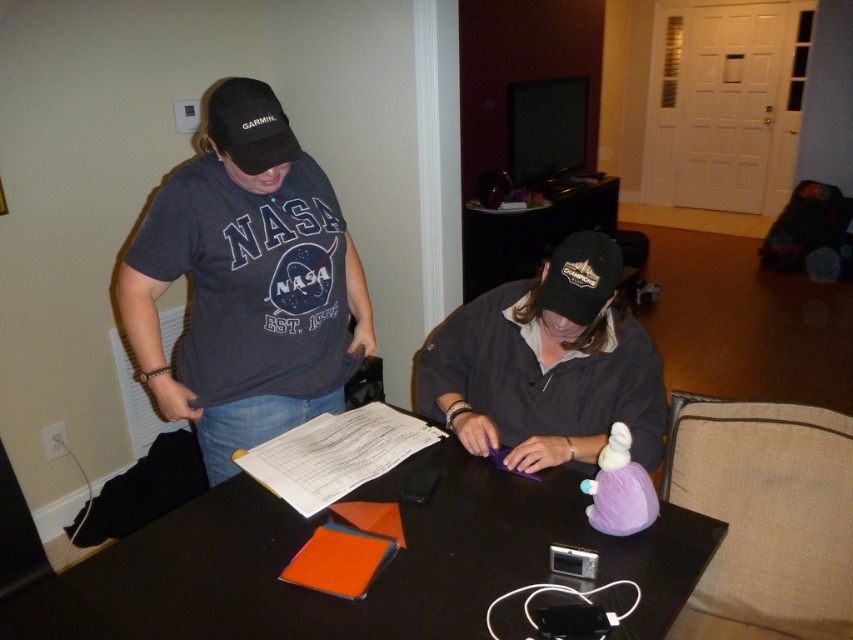
Question: Estimate the real-world distances between objects in this image. Which object is closer to the black fabric baseball cap at center?

Choices:
 (A) black matte cap at center
 (B) black glossy table at center
 (C) black fabric baseball cap at upper left
 (D) matte black t-shirt at left

Answer: (A)

Question: Is black glossy table at center wider than black fabric baseball cap at upper left?

Choices:
 (A) yes
 (B) no

Answer: (A)

Question: Which point is closer to the camera?

Choices:
 (A) (180, 176)
 (B) (590, 310)

Answer: (B)

Question: Is black glossy table at center above black fabric baseball cap at upper left?

Choices:
 (A) no
 (B) yes

Answer: (A)

Question: Is matte black t-shirt at left further to camera compared to black fabric baseball cap at center?

Choices:
 (A) yes
 (B) no

Answer: (B)

Question: Which point is farther to the camera?

Choices:
 (A) black glossy table at center
 (B) black matte cap at center
 (C) black fabric baseball cap at upper left
 (D) matte black t-shirt at left

Answer: (B)